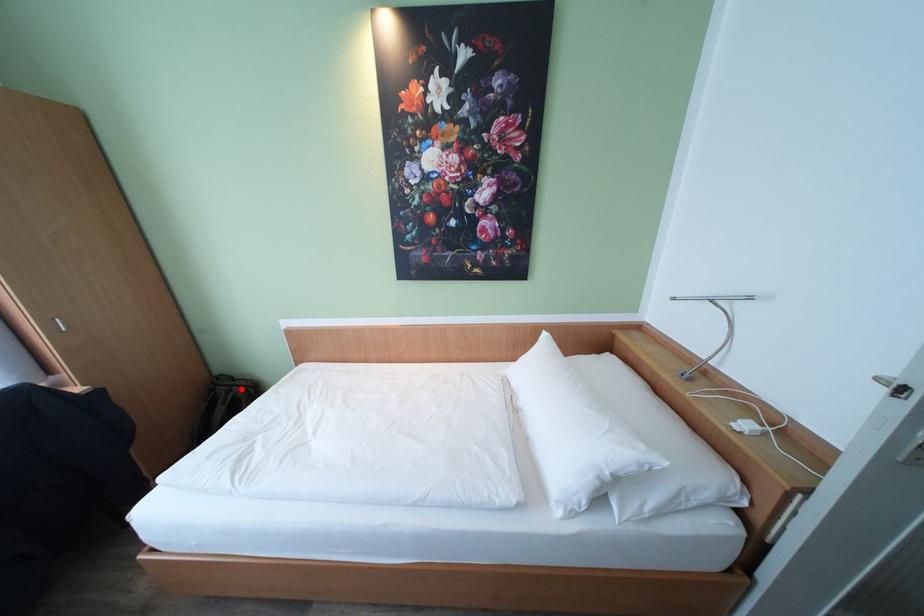
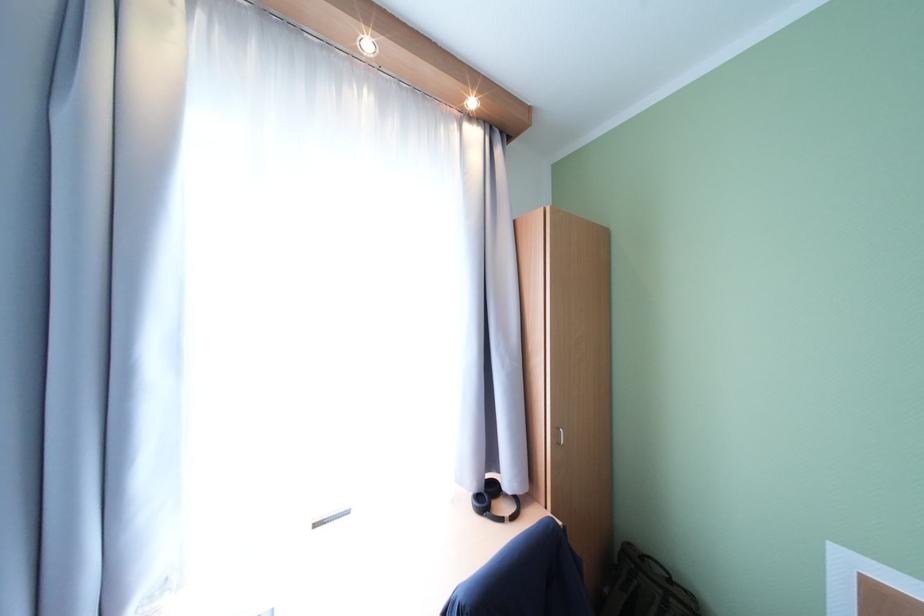
The point at the highlighted location is marked in the first image. Where is the corresponding point in the second image?

(679, 602)